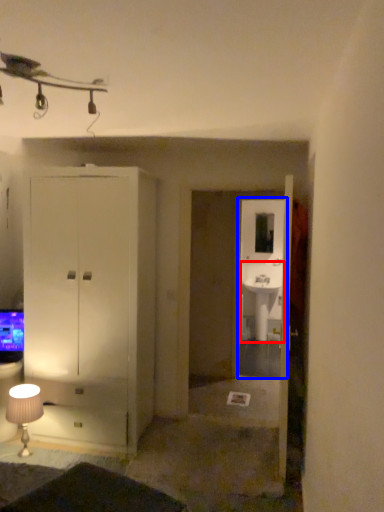
Question: Which point is closer to the camera, sink (highlighted by a red box) or glass door (highlighted by a blue box)?

Choices:
 (A) sink
 (B) glass door

Answer: (B)